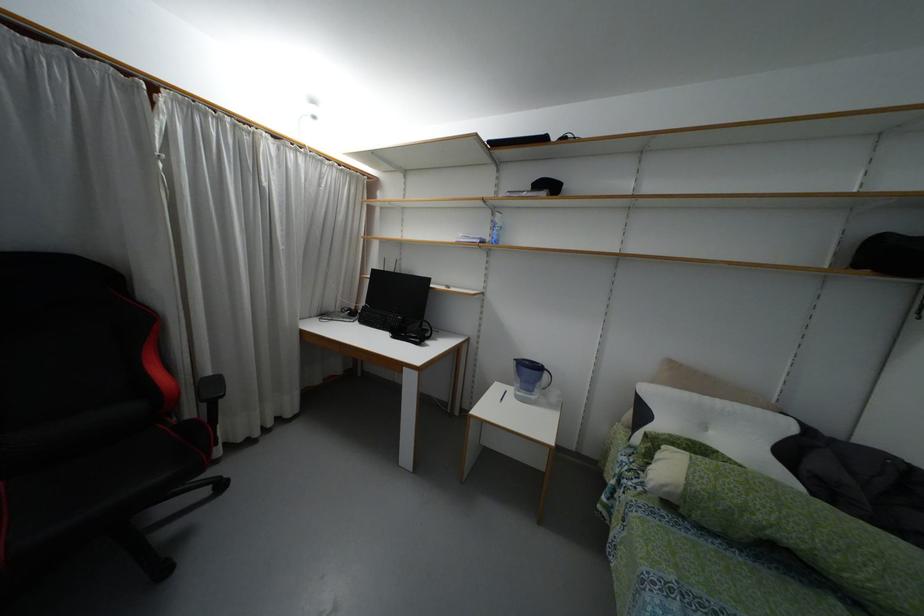
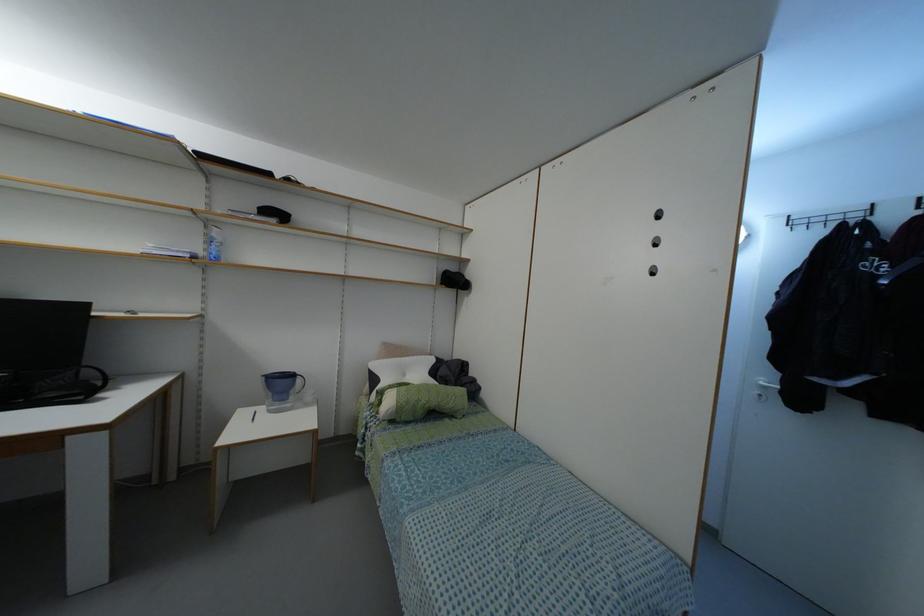
The point at (495, 241) is marked in the first image. Where is the corresponding point in the second image?

(216, 257)